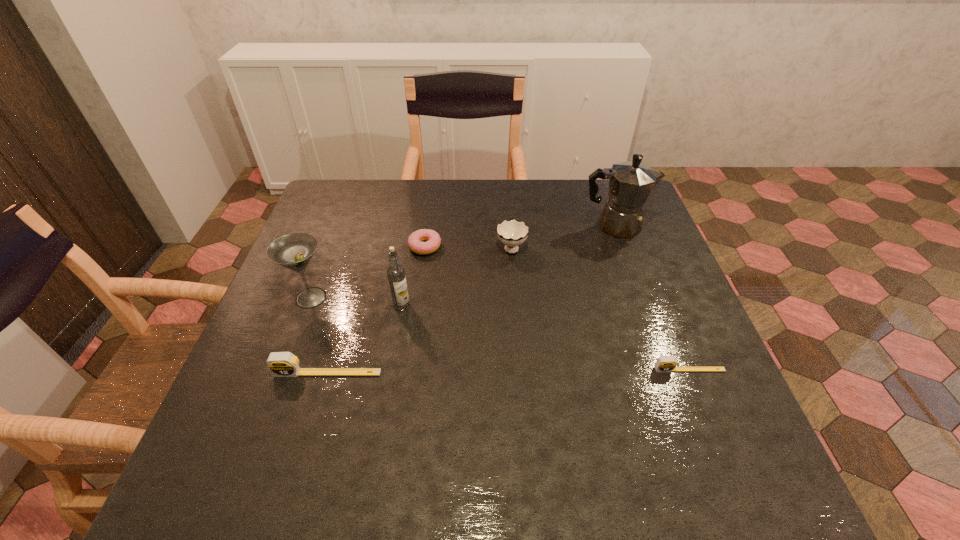
Locate an element on the screen. The image size is (960, 540). the fifth tallest object is located at coordinates (281, 364).

This screenshot has width=960, height=540. In order to click on the taller tape measure in this screenshot , I will do `click(281, 364)`.

Locate an element on the screen. the shorter tape measure is located at coordinates (664, 363).

Where is `the fourth shortest object`? This screenshot has width=960, height=540. the fourth shortest object is located at coordinates (512, 233).

Find the location of a particular element. This screenshot has height=540, width=960. the third object from right to left is located at coordinates point(512,233).

I want to click on the tallest object, so click(630, 183).

At what (x,y) coordinates should I click in order to perform the action: click on vodka. Please return your answer as a coordinate pair (x, y). Looking at the image, I should click on (396, 273).

The image size is (960, 540). I want to click on doughnut, so click(x=415, y=241).

Where is `martini`? This screenshot has height=540, width=960. martini is located at coordinates (294, 251).

What are the coordinates of `free space located at the front of the left tape measure with the tape extended` in the screenshot? It's located at (312, 427).